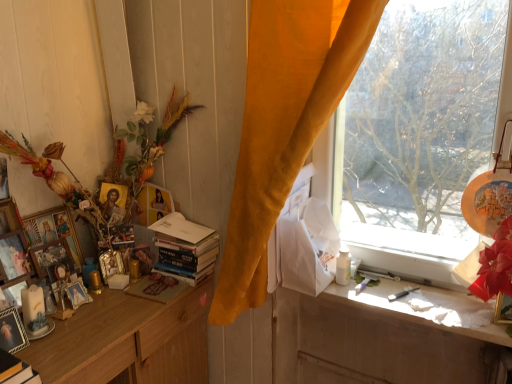
Identify the location of vacant point to the right of matte gold picture frame at left, marked as the 7th picture frame in a right-to-left arrangement. The image size is (512, 384). (79, 322).